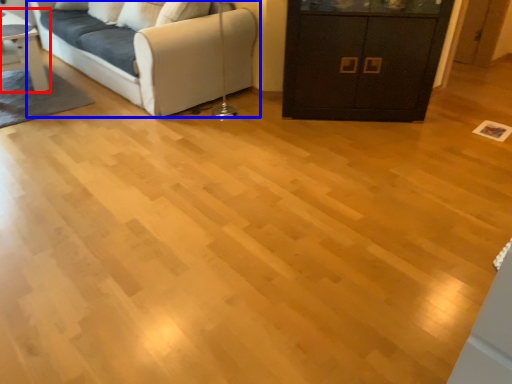
Question: Among these objects, which one is farthest to the camera, table (highlighted by a red box) or studio couch (highlighted by a blue box)?

Choices:
 (A) table
 (B) studio couch

Answer: (A)